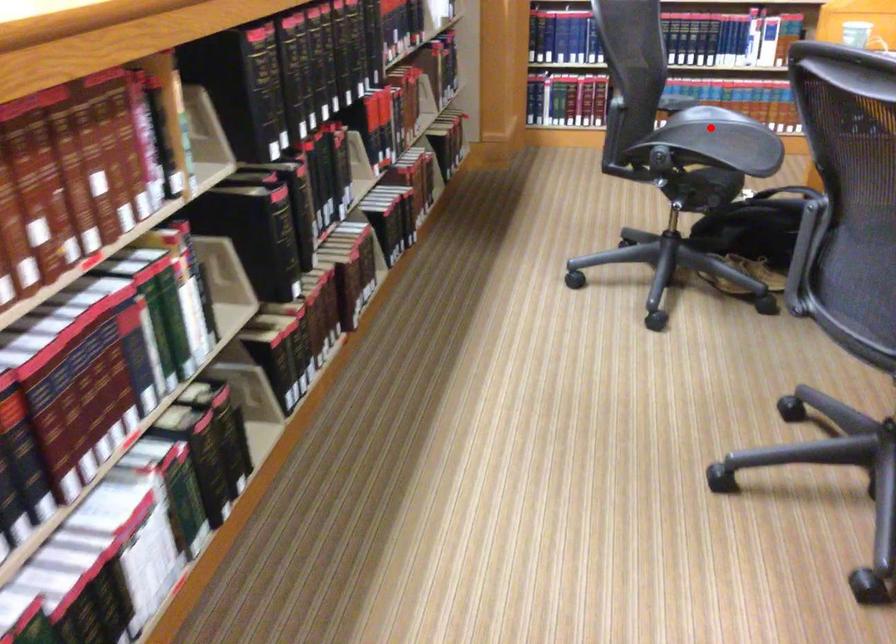
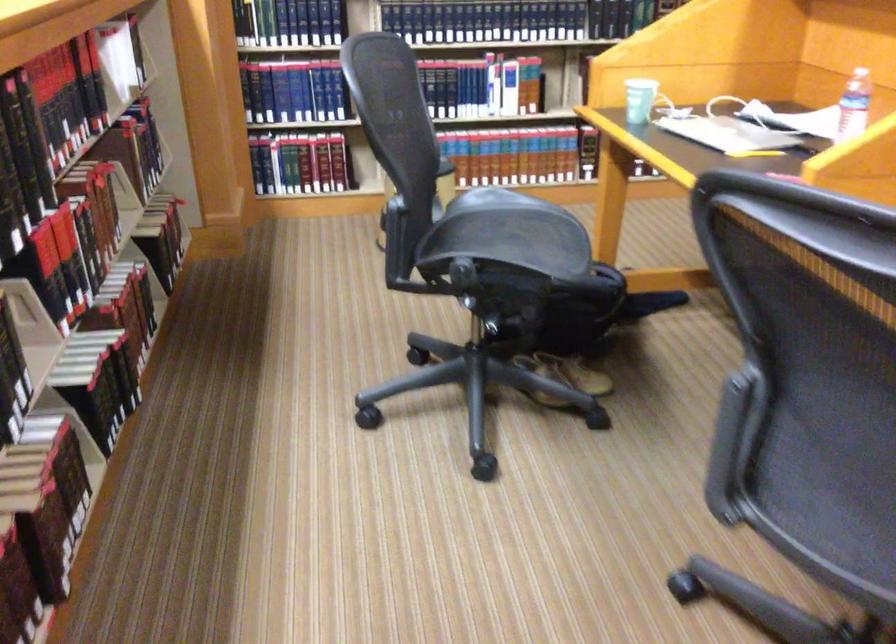
Question: I am providing you with two images of the same scene from different viewpoints. Image1 has a red point marked. In image2, the corresponding 3D location appears at what relative position? Reply with the corresponding letter.

Choices:
 (A) Closer
 (B) Farther

Answer: (A)